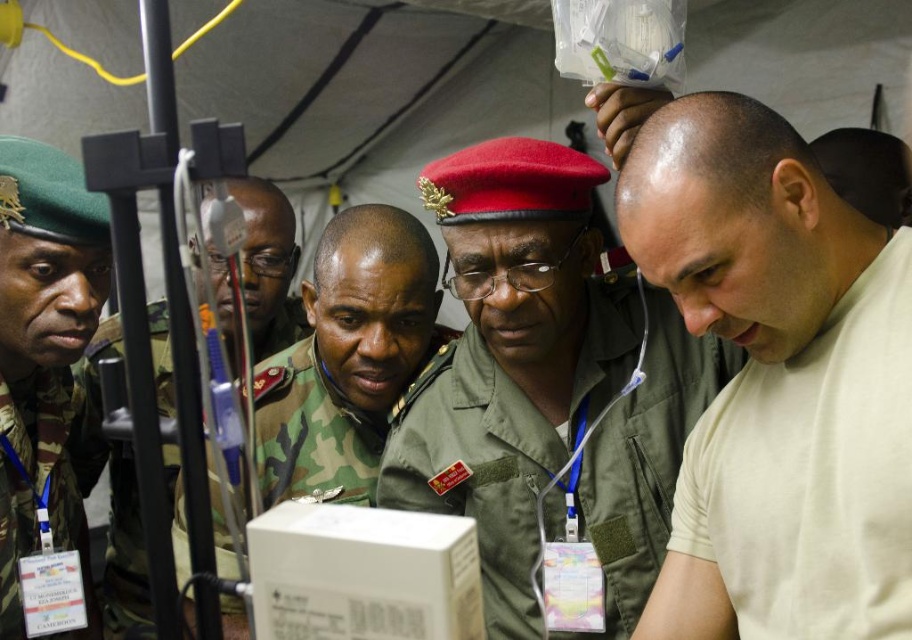
Consider the image. You are a medic in a field hospital tent. You need to quickly identify the person in charge. The person in charge is always wearing a red beret with a gold emblem. Among the beige cotton shirt at center and the camouflage uniform at center, which one is more likely to be the person in charge?

The beige cotton shirt at center is positioned on the right side of camouflage uniform at center, but the description does not mention any red beret with a gold emblem. Based on the scene description, the individual with the red beret and gold emblem is likely the person in charge, but neither the beige cotton shirt at center nor the camouflage uniform at center are described as having this beret. Therefore, the answer cannot be determined from the provided information.

You are a medic in the field and need to reach a critical piece of medical equipment located at point (x=506, y=412). Your medical kit is 2.5 feet wide. Can you safely move through the space between yourself and the equipment without bumping into the medical team members?

The distance between you and point (x=506, y=412) is 4.14 feet. Since your medical kit is 2.5 feet wide, there is sufficient space to move through the area without obstruction as long as you navigate carefully around the medical team members.